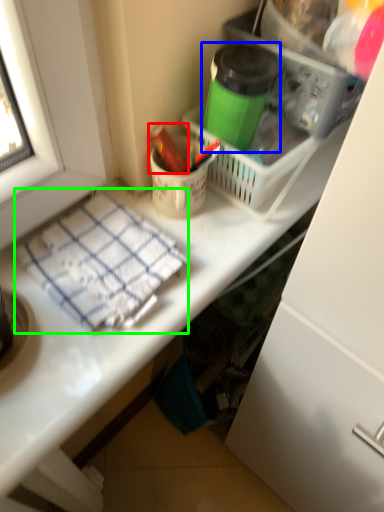
Question: Which object is positioned closest to crayon (highlighted by a red box)? Select from bottle (highlighted by a blue box) and blanket (highlighted by a green box).

Choices:
 (A) bottle
 (B) blanket

Answer: (A)